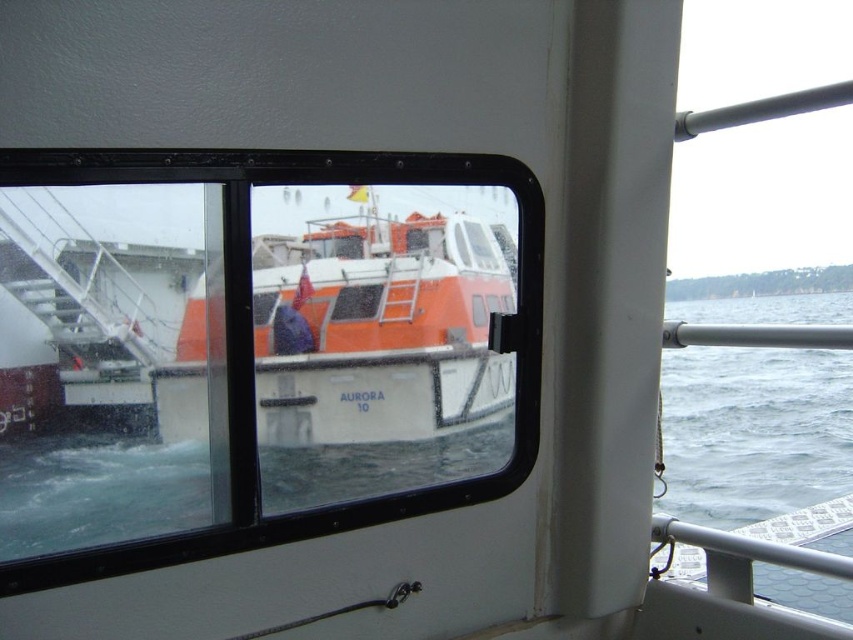
Question: Can you confirm if orange matte boat at center is wider than gray water at lower right?

Choices:
 (A) no
 (B) yes

Answer: (A)

Question: Is orange matte boat at center thinner than gray water at lower right?

Choices:
 (A) yes
 (B) no

Answer: (A)

Question: Is orange matte boat at center positioned in front of gray water at lower right?

Choices:
 (A) yes
 (B) no

Answer: (A)